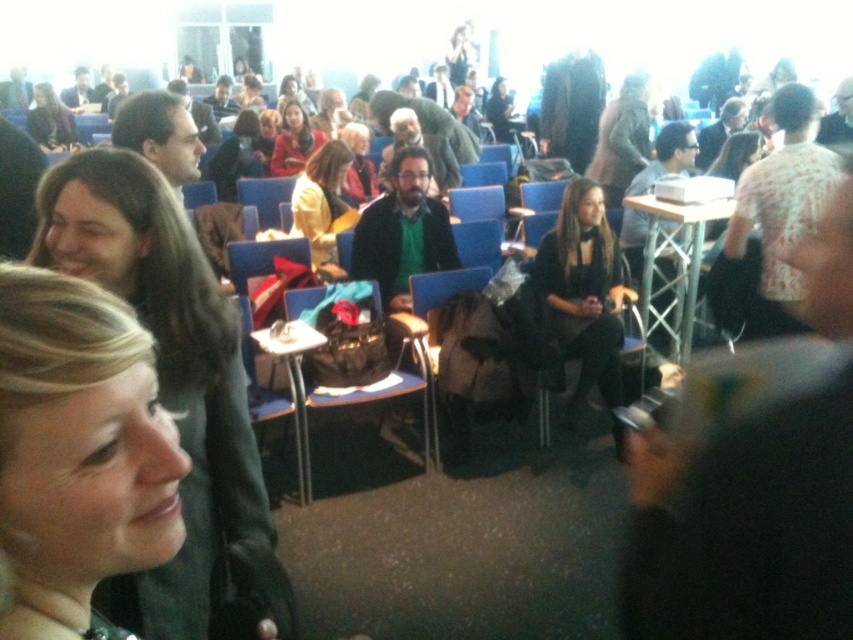
Question: Which point appears closest to the camera in this image?

Choices:
 (A) pos(332,205)
 (B) pos(57,125)

Answer: (A)

Question: Which object appears farthest from the camera in this image?

Choices:
 (A) matte black jacket at center
 (B) black satin dress at center
 (C) dark brown hair at upper left
 (D) blonde hair at lower left

Answer: (A)

Question: Does black satin dress at center come behind metallic silver table at center?

Choices:
 (A) yes
 (B) no

Answer: (A)

Question: Is metallic silver table at center to the left of matte black jacket at upper left from the viewer's perspective?

Choices:
 (A) no
 (B) yes

Answer: (A)

Question: Which of the following is the farthest from the observer?

Choices:
 (A) matte black jacket at center
 (B) black satin dress at center

Answer: (A)

Question: Does blonde hair at lower left come in front of black satin dress at center?

Choices:
 (A) yes
 (B) no

Answer: (A)